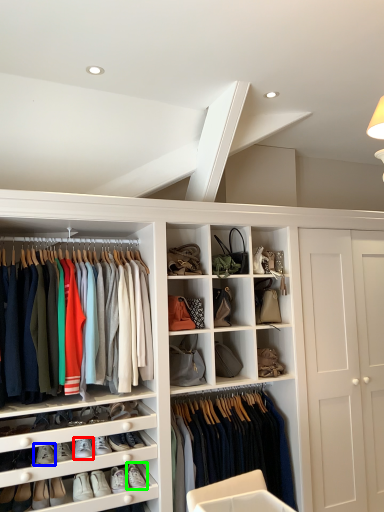
Question: Which object is the farthest from footwear (highlighted by a red box)? Choose among these: footwear (highlighted by a blue box) or footwear (highlighted by a green box).

Choices:
 (A) footwear
 (B) footwear

Answer: (B)